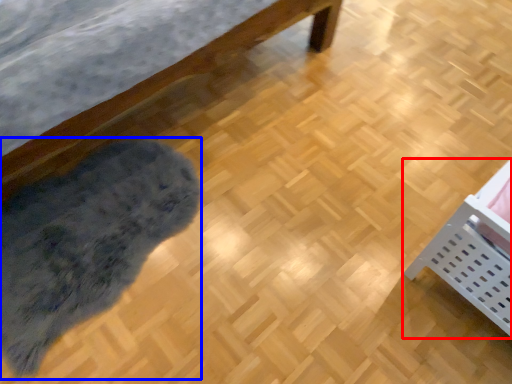
Question: Among these objects, which one is nearest to the camera, furniture (highlighted by a red box) or mat (highlighted by a blue box)?

Choices:
 (A) furniture
 (B) mat

Answer: (A)